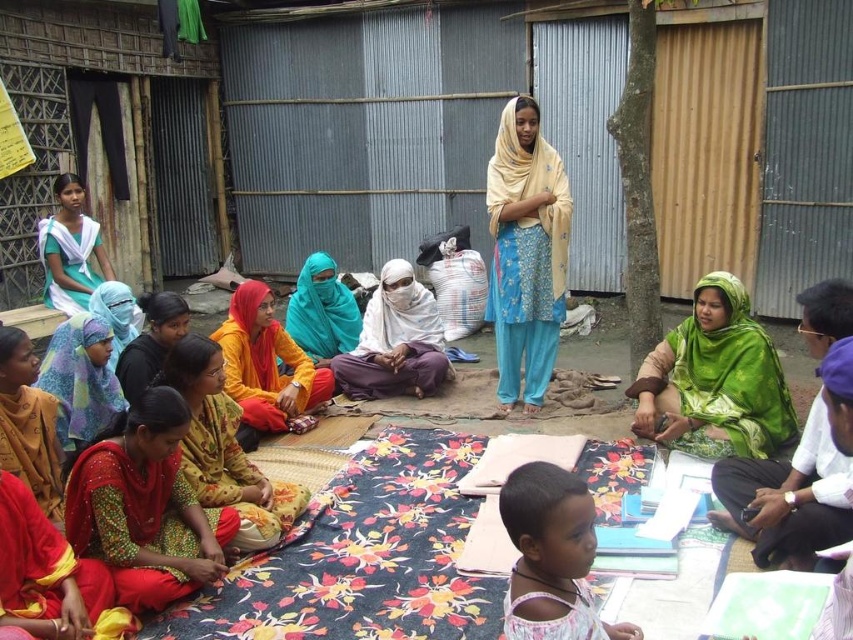
Based on the photo, you are standing in the rural setting and see the green satin scarf at lower right and the teal fabric headscarf at center. Which one is positioned more to the right side?

Answer: The green satin scarf at lower right is positioned more to the right side than the teal fabric headscarf at center.

You are a photographer trying to capture a closeup of the red fabric saree at lower left without the matte blue scarf at lower left blocking the view. Can you adjust your position to do so?

The red fabric saree at lower left is in front of the matte blue scarf at lower left, so you can capture a closeup of the red fabric saree at lower left without the matte blue scarf at lower left blocking the view by positioning yourself in front of the red fabric saree at lower left.

Based on the photo, which object is located at the coordinates point (144, 508)?

The red fabric saree at lower left is located at point (144, 508).